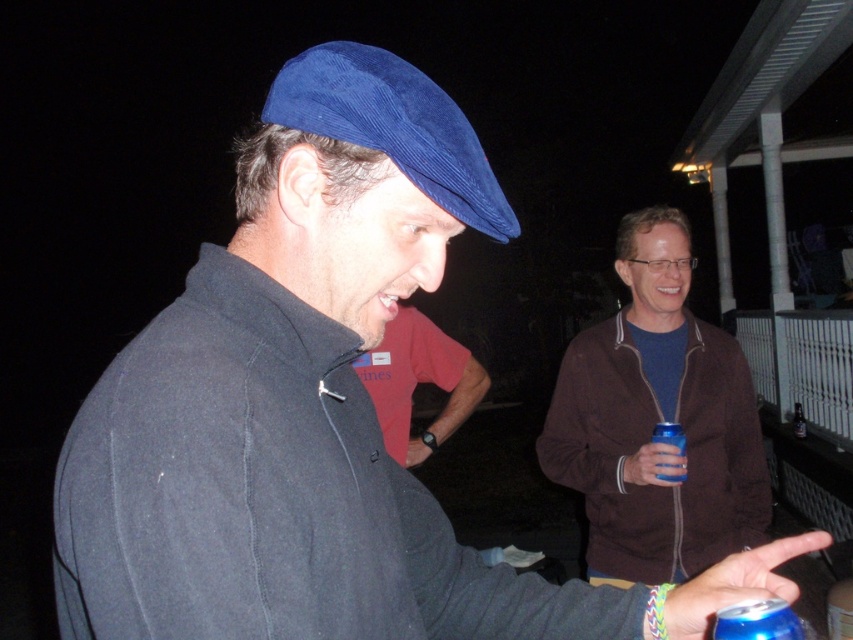
You are standing at point (x=418, y=381) in the image and want to move towards the red cotton t shirt at center. Is the path clear?

The path is clear because the red cotton t shirt at center is located exactly at your current position.